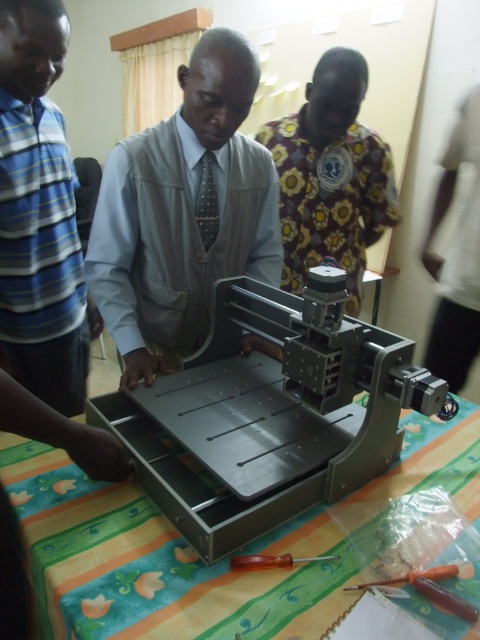
This screenshot has height=640, width=480. In order to click on metallic gray vest at center in this screenshot , I will do `click(182, 211)`.

Does metallic gray vest at center have a larger size compared to orange plastic screwdriver at center?

Yes, metallic gray vest at center is bigger than orange plastic screwdriver at center.

Is point (266, 205) positioned before point (414, 572)?

No, it is not.

Locate an element on the screen. metallic gray vest at center is located at coordinates (182, 211).

Is multicolored fabric tablecloth at center positioned behind floral fabric shirt at upper center?

No, multicolored fabric tablecloth at center is in front of floral fabric shirt at upper center.

Can you confirm if multicolored fabric tablecloth at center is shorter than floral fabric shirt at upper center?

Yes.

Does point (38, 563) come farther from viewer compared to point (301, 257)?

That is False.

At what (x,y) coordinates should I click in order to perform the action: click on multicolored fabric tablecloth at center. Please return your answer as a coordinate pair (x, y). Image resolution: width=480 pixels, height=640 pixels. Looking at the image, I should click on (157, 563).

Who is taller, multicolored fabric tablecloth at center or blue striped shirt at left?

blue striped shirt at left is taller.

Can you confirm if multicolored fabric tablecloth at center is smaller than blue striped shirt at left?

Yes.

Who is more forward, (63, 636) or (29, 362)?

Point (63, 636) is more forward.

This screenshot has height=640, width=480. Identify the location of multicolored fabric tablecloth at center. (157, 563).